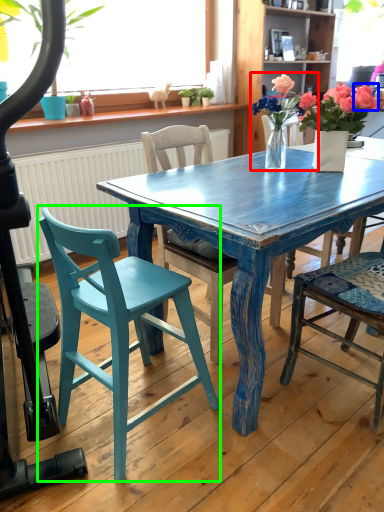
Question: Which object is the farthest from houseplant (highlighted by a red box)? Choose among these: flower (highlighted by a blue box) or chair (highlighted by a green box).

Choices:
 (A) flower
 (B) chair

Answer: (B)